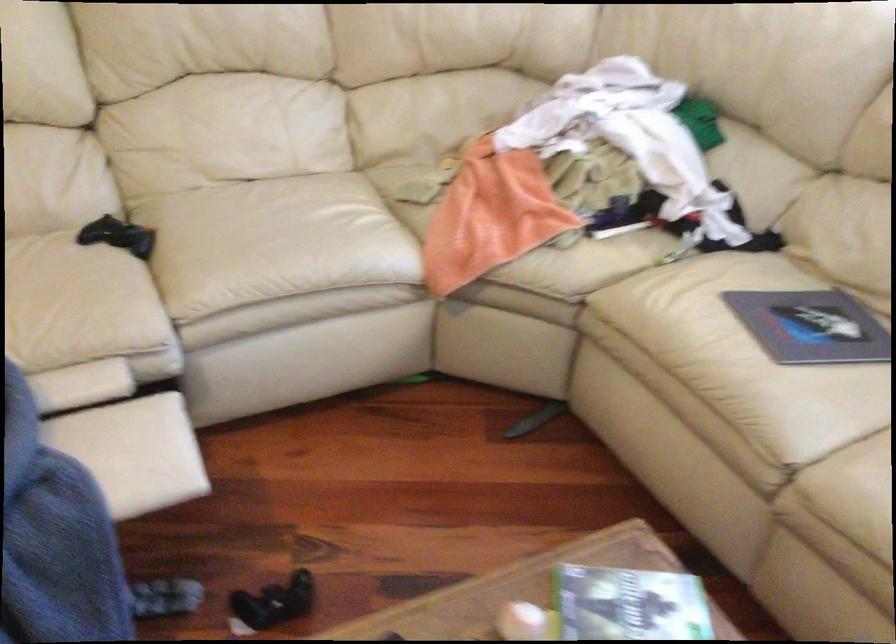
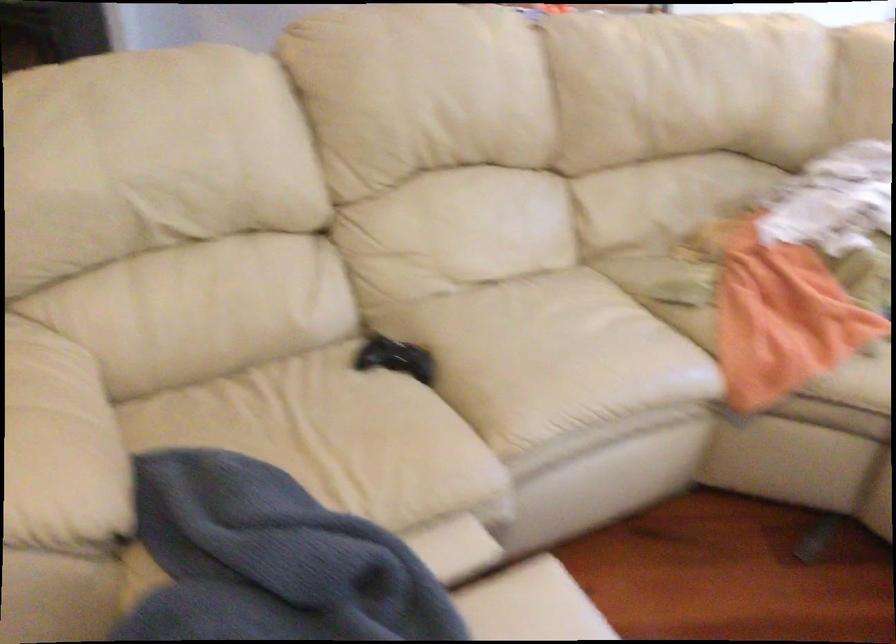
Question: The images are taken continuously from a first-person perspective. In which direction are you moving?

Choices:
 (A) Left
 (B) Right
 (C) Forward
 (D) Backward

Answer: (A)